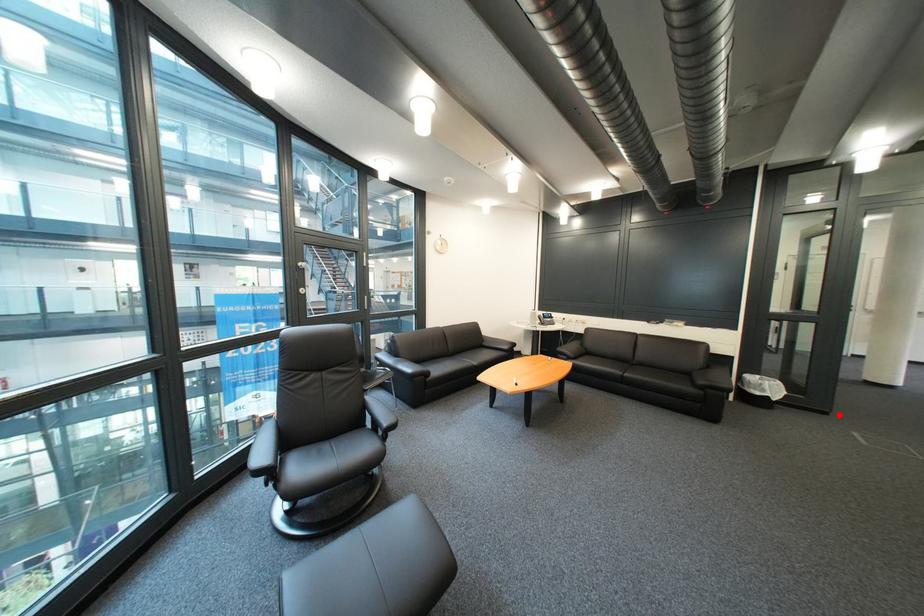
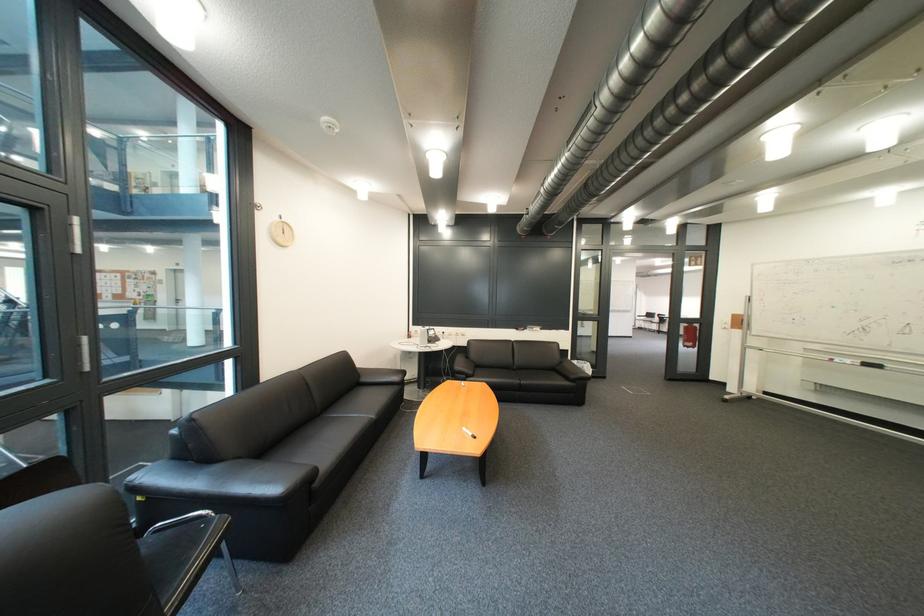
Where in the second image is the point corresponding to the highlighted location from the first image?

(618, 379)